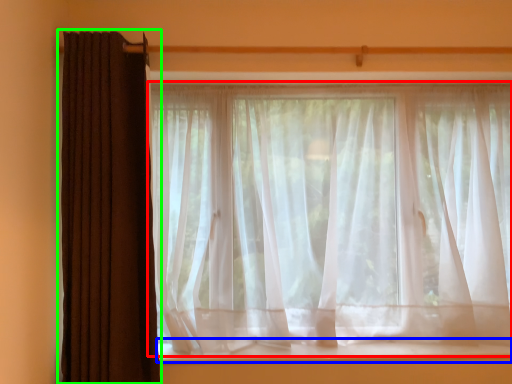
Question: Estimate the real-world distances between objects in this image. Which object is closer to curtain (highlighted by a red box), window sill (highlighted by a blue box) or curtain (highlighted by a green box)?

Choices:
 (A) window sill
 (B) curtain

Answer: (A)